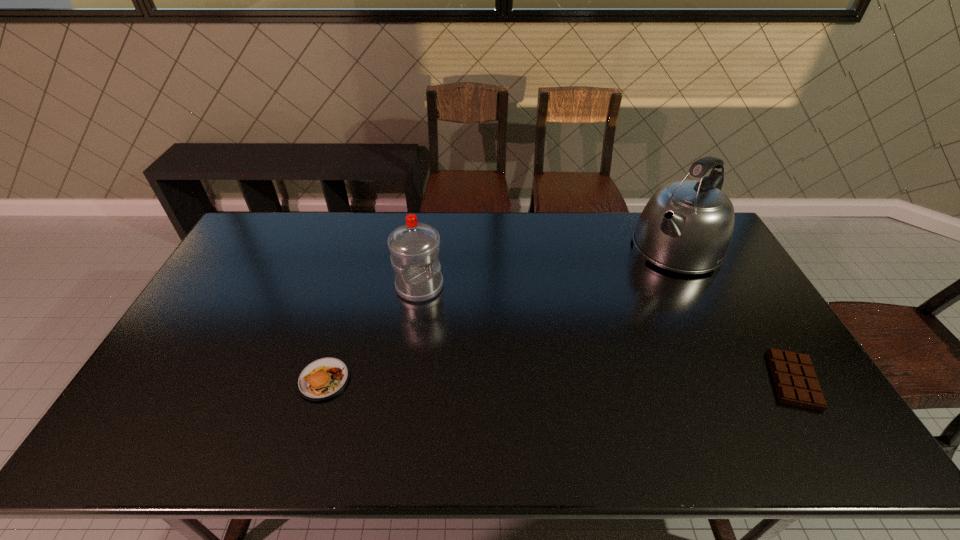
The image size is (960, 540). What are the coordinates of `vacant space situated 0.380m on the spout of the kettle` in the screenshot? It's located at (592, 331).

Identify the location of free spot located on the handle side of the water bottle. The width and height of the screenshot is (960, 540). (454, 314).

Where is `free space located on the handle side of the water bottle`? free space located on the handle side of the water bottle is located at coordinates (512, 360).

The width and height of the screenshot is (960, 540). In order to click on vacant space situated on the handle side of the water bottle in this screenshot , I will do `click(454, 314)`.

Identify the location of object present at the far edge. (687, 226).

This screenshot has height=540, width=960. What are the coordinates of `patty located in the near edge section of the desktop` in the screenshot? It's located at (324, 378).

Locate an element on the screen. candy bar at the near edge is located at coordinates (795, 380).

This screenshot has height=540, width=960. In order to click on candy bar that is at the right edge in this screenshot , I will do `click(795, 380)`.

Find the location of a particular element. The image size is (960, 540). kettle situated at the right edge is located at coordinates (687, 226).

You are a GUI agent. You are given a task and a screenshot of the screen. Output one action in this format:
    pyautogui.click(x=<x>, y=<y>)
    Task: Click on the object positioned at the far right corner
    The height and width of the screenshot is (540, 960).
    Given the screenshot: What is the action you would take?
    pyautogui.click(x=687, y=226)